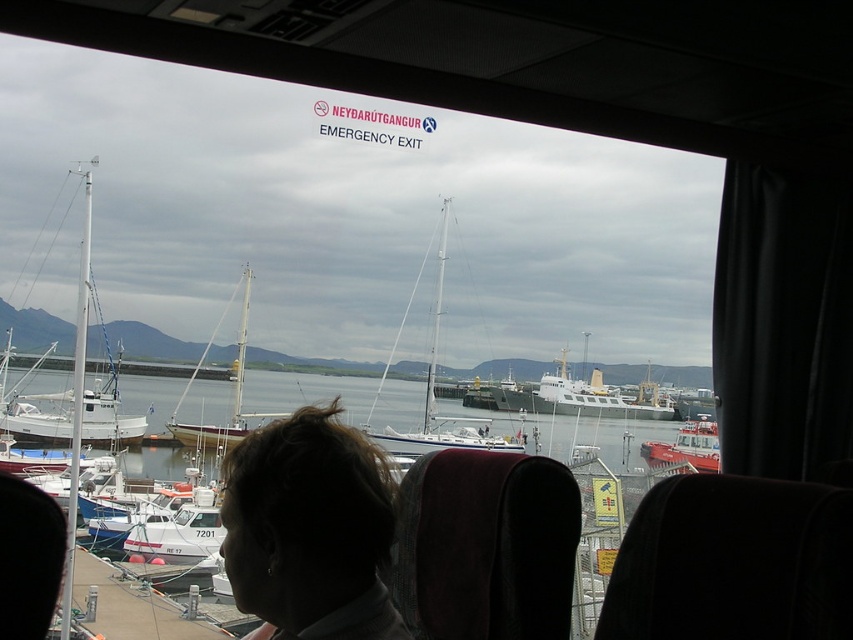
You are a passenger on the ferry and want to observe the white matte sailboat at left. From your seat, where should you look relative to the clear water at center to see it?

The white matte sailboat at left is above the clear water at center, so you should look upward from the clear water at center to see it.

You are a passenger on the ferry and want to take a photo of the marina. There is a person with dark brown hair at center blocking your view. Where should you move to avoid their hair blocking the photo?

The person with dark brown hair at center is located at point [309,529]. To avoid their hair blocking the photo, move either to the left or right of the dark brown hair at center to position yourself outside the area where their hair is obstructing the view.

You are a passenger on a bus or ferry and want to compare the sizes of the boats outside. Which boat is smaller when looking at the white wooden sailboat at center and the red rubber dinghy at lower right?

The white wooden sailboat at center is smaller compared to the red rubber dinghy at lower right.